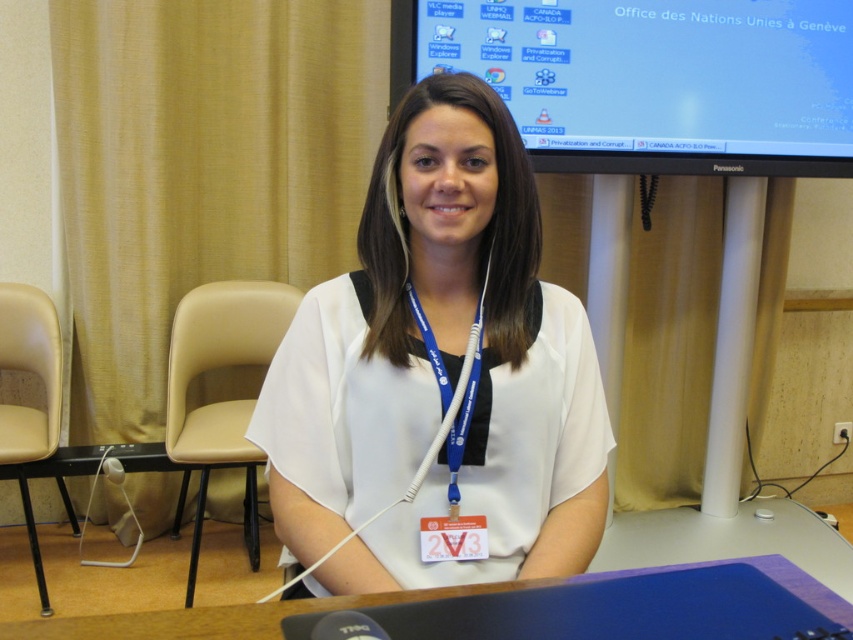
Question: Does white matte shirt at center lie in front of matte black monitor at upper center?

Choices:
 (A) yes
 (B) no

Answer: (A)

Question: Which point is closer to the camera taking this photo?

Choices:
 (A) (405, 250)
 (B) (96, 573)
 (C) (292, 419)
 (D) (601, 163)

Answer: (C)

Question: Does white matte shirt at center appear over white plastic table at center?

Choices:
 (A) yes
 (B) no

Answer: (A)

Question: Which point appears closest to the camera in this image?

Choices:
 (A) (531, 324)
 (B) (399, 236)

Answer: (B)

Question: In this image, where is white matte shirt at center located relative to white plastic table at center?

Choices:
 (A) left
 (B) right

Answer: (B)

Question: Among these points, which one is nearest to the camera?

Choices:
 (A) (242, 604)
 (B) (550, 32)
 (C) (469, 272)
 (D) (408, 262)

Answer: (D)